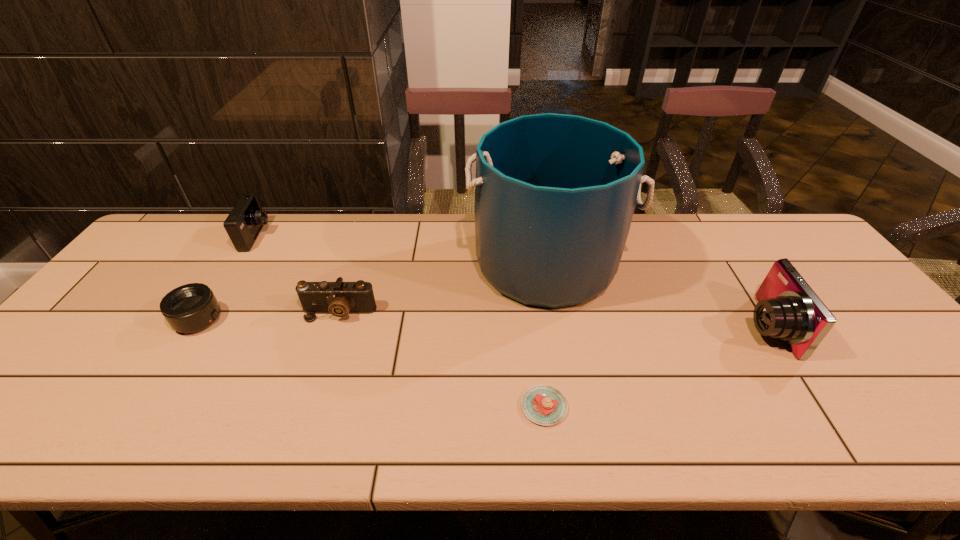
The height and width of the screenshot is (540, 960). Find the location of `object that is positioned at the near edge`. object that is positioned at the near edge is located at coordinates (545, 405).

In the image, there is a desktop. Where is `vacant space at the far edge`? This screenshot has height=540, width=960. vacant space at the far edge is located at coordinates (374, 238).

Locate an element on the screen. The width and height of the screenshot is (960, 540). free region at the near edge is located at coordinates (297, 424).

The height and width of the screenshot is (540, 960). What are the coordinates of `free spot at the left edge of the desktop` in the screenshot? It's located at (130, 296).

In order to click on free space at the far left corner of the desktop in this screenshot , I will do `click(195, 233)`.

The height and width of the screenshot is (540, 960). I want to click on vacant space that is in between the shortest camera and the pastry, so click(442, 360).

At what (x,y) coordinates should I click in order to perform the action: click on free space between the shortest object and the leftmost camera. Please return your answer as a coordinate pair (x, y). Looking at the image, I should click on (400, 321).

The image size is (960, 540). In order to click on unoccupied area between the shortest camera and the rightmost camera in this screenshot , I will do `click(552, 320)`.

I want to click on unoccupied position between the second camera from left to right and the rightmost camera, so click(552, 320).

The image size is (960, 540). In order to click on empty space between the fifth tallest object and the shortest object in this screenshot , I will do `click(372, 363)`.